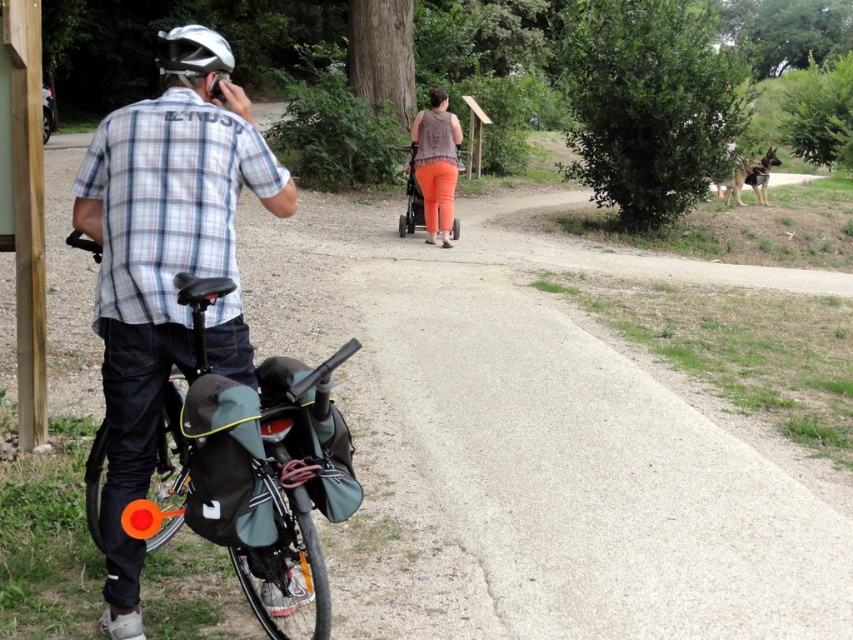
Is silver metallic helmet at upper left taller than matte black stroller at center?

Indeed, silver metallic helmet at upper left has a greater height compared to matte black stroller at center.

Consider the image. Does silver metallic helmet at upper left come in front of matte black stroller at center?

Yes, silver metallic helmet at upper left is closer to the viewer.

Is point (164, 38) positioned before point (416, 211)?

That is True.

The image size is (853, 640). Find the location of `silver metallic helmet at upper left`. silver metallic helmet at upper left is located at coordinates (193, 52).

Between orange cotton pants at center and matte black stroller at center, which one appears on the right side from the viewer's perspective?

orange cotton pants at center

Is orange cotton pants at center closer to the viewer compared to matte black stroller at center?

Yes, orange cotton pants at center is closer to the viewer.

Where is `orange cotton pants at center`? This screenshot has width=853, height=640. orange cotton pants at center is located at coordinates (436, 163).

You are a GUI agent. You are given a task and a screenshot of the screen. Output one action in this format:
    pyautogui.click(x=<x>, y=<y>)
    Task: Click on the orange cotton pants at center
    The image size is (853, 640).
    Given the screenshot: What is the action you would take?
    pyautogui.click(x=436, y=163)

Between matte plaid shirt at left and orange cotton pants at center, which one appears on the right side from the viewer's perspective?

From the viewer's perspective, orange cotton pants at center appears more on the right side.

Which of these two, matte plaid shirt at left or orange cotton pants at center, stands shorter?

matte plaid shirt at left is shorter.

Which is in front, point (183, 92) or point (445, 163)?

Point (183, 92)

The height and width of the screenshot is (640, 853). Find the location of `matte plaid shirt at left`. matte plaid shirt at left is located at coordinates (160, 273).